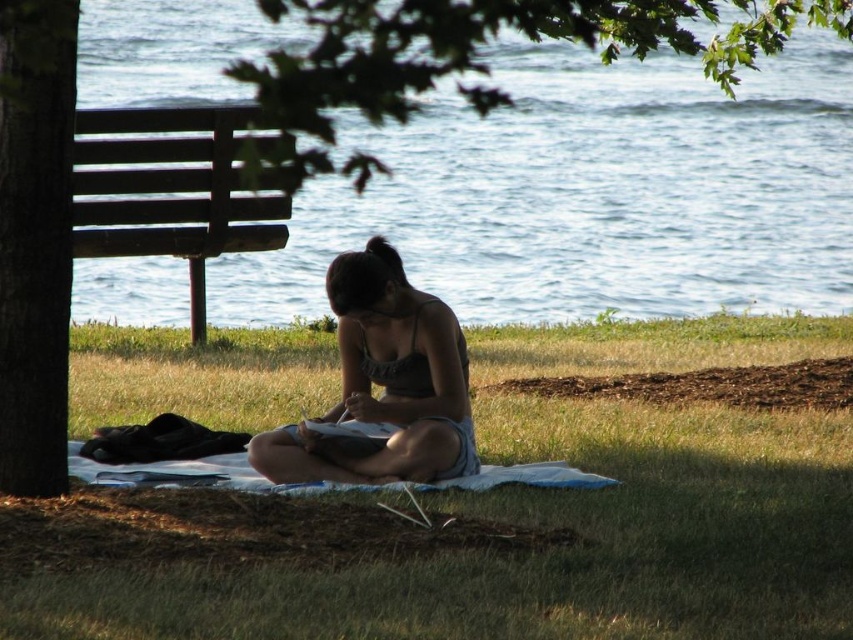
You are planning to set up a picnic area in the scene described. Given that the green grass at center and blue water at center are both present, which area would be more suitable for placing a large picnic blanket? Explain your reasoning based on their sizes.

The blue water at center is larger in size compared to the green grass at center. Therefore, the blue water at center would be more suitable for placing a large picnic blanket as it offers a bigger space.

Looking at this image, you are a photographer wanting to capture the matte black tank top at center and the brown wooden bench at left in a single shot. Based on their positions, can you tell which object is closer to the camera?

The matte black tank top at center is located below the brown wooden bench at left, meaning the bench is closer to the camera than the tank top.